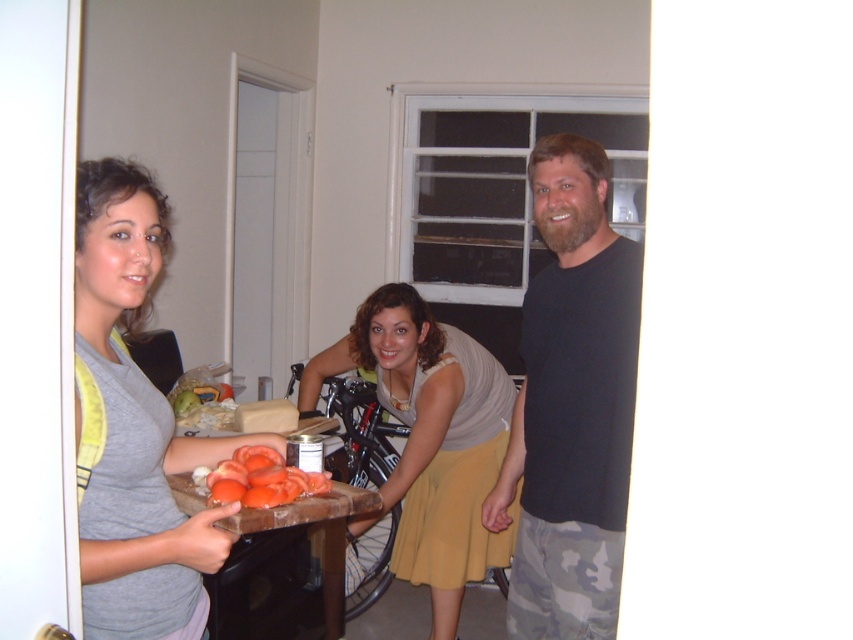
Question: Which object is the farthest from the gray matte shirt at left?

Choices:
 (A) black matte t-shirt at right
 (B) wooden cutting board at center
 (C) matte gray tank top at center

Answer: (C)

Question: Is gray matte shirt at left thinner than smooth orange tomatoes at center?

Choices:
 (A) no
 (B) yes

Answer: (A)

Question: Is black matte t-shirt at right positioned at the back of gray matte shirt at left?

Choices:
 (A) yes
 (B) no

Answer: (A)

Question: Is gray matte shirt at left further to camera compared to wooden cutting board at center?

Choices:
 (A) yes
 (B) no

Answer: (B)

Question: Which point appears closest to the camera in this image?

Choices:
 (A) (83, 390)
 (B) (218, 486)
 (C) (538, 291)
 (D) (437, 616)

Answer: (A)

Question: Which point is closer to the camera taking this photo?

Choices:
 (A) [306, 570]
 (B) [259, 474]

Answer: (B)